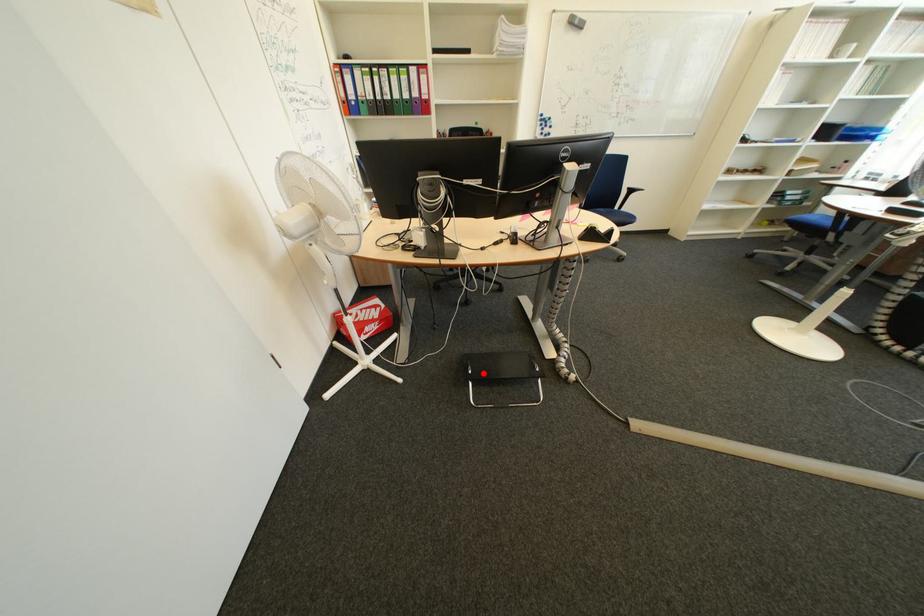
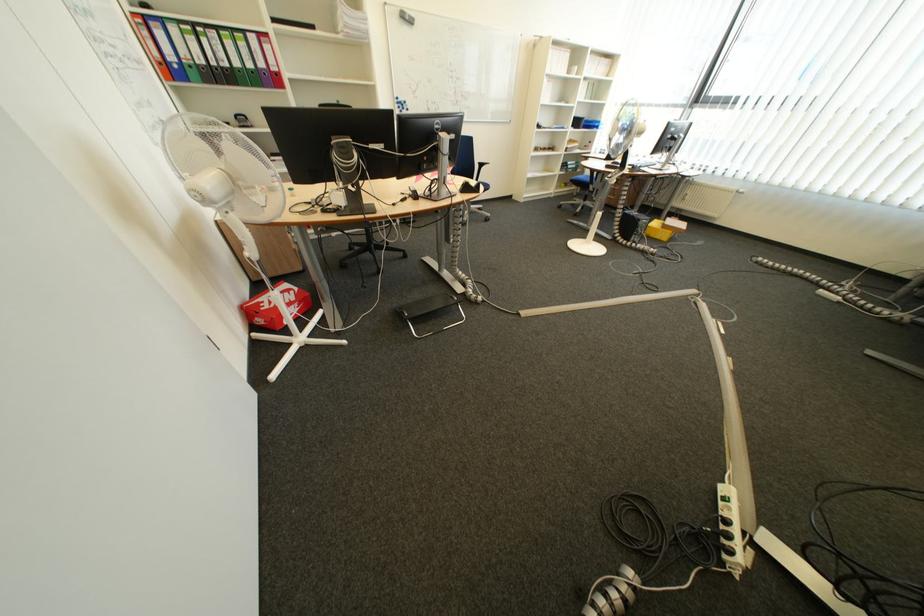
Locate, in the second image, the point that corresponds to the highlighted location in the first image.

(419, 315)